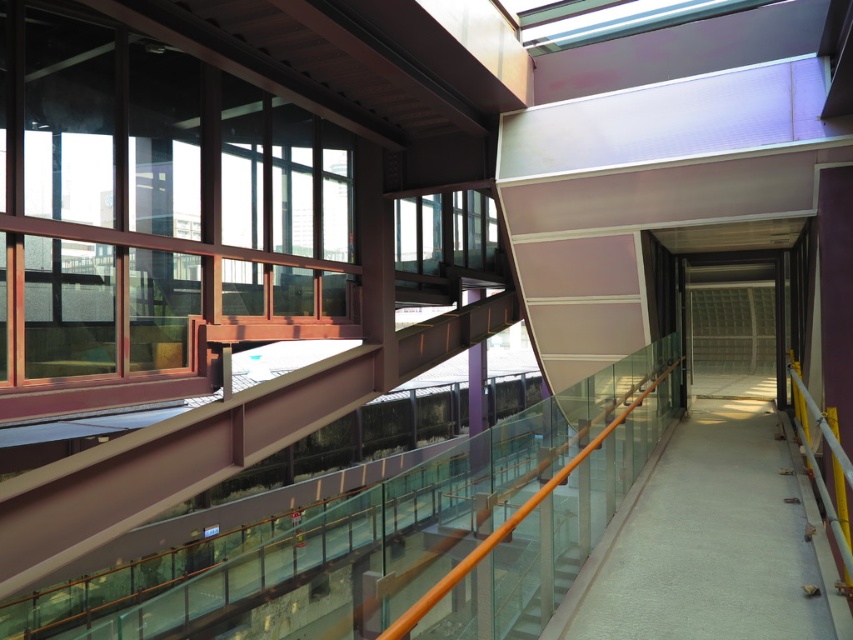
You are an architect designing a new layout for this space. You need to place a 3m wide sculpture between the smooth concrete walkway at center and the white glossy stairs at center. Can the space accommodate this sculpture?

The smooth concrete walkway at center is wider than the white glossy stairs at center. However, the combined width of both might not be sufficient to fit a 3m wide sculpture. More information about their exact widths is needed to determine feasibility.

You are an architect designing a new layout for this space. You need to place a large sculpture that requires a flat, unobstructed surface. Which object from the scene would be more suitable for this purpose, the smooth concrete walkway at center or the white glossy stairs at center?

The smooth concrete walkway at center is positioned under the white glossy stairs at center, so the walkway would be the more suitable surface for placing the sculpture as it is flat and unobstructed.

You are standing in the modern architectural space and want to move from the glass wall on the left to the point labeled point (686,611). There is an obstacle at point labeled point (538,593). Will you be able to reach your destination without going around the obstacle?

Point (686,611) is behind point (538,593), so you cannot reach the destination without going around the obstacle.